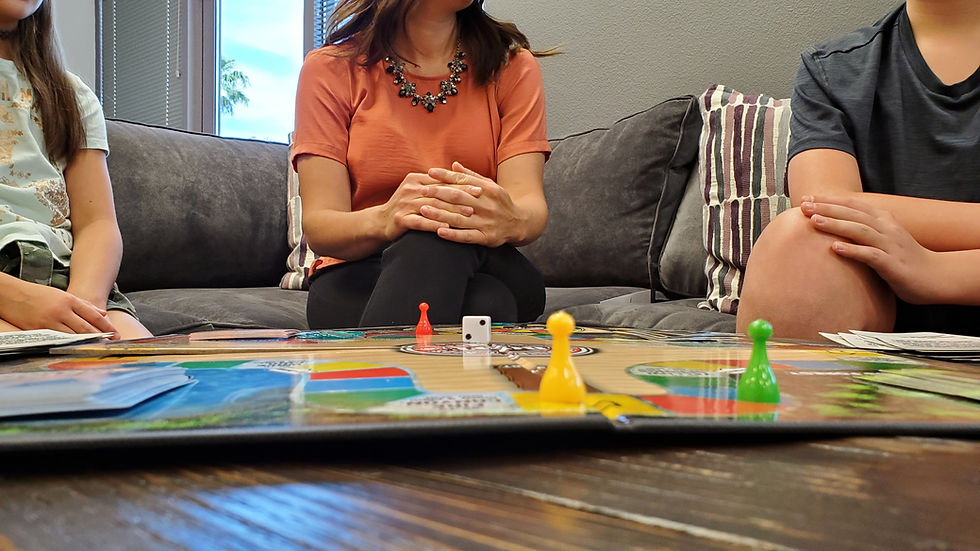
At what (x,y) coordinates should I click in order to perform the action: click on blinds. Please return your answer as a coordinate pair (x, y). Image resolution: width=980 pixels, height=551 pixels. Looking at the image, I should click on (147, 69), (316, 12).